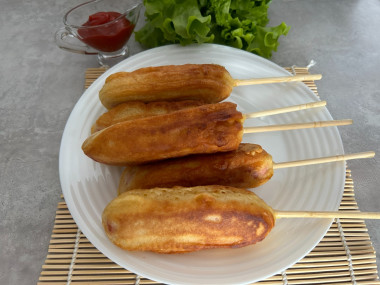
The height and width of the screenshot is (285, 380). What are the coordinates of `counter` in the screenshot? It's located at (18, 118).